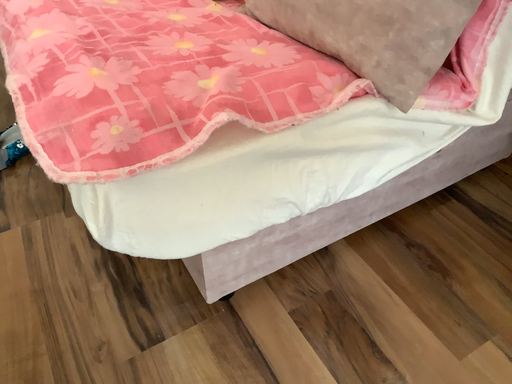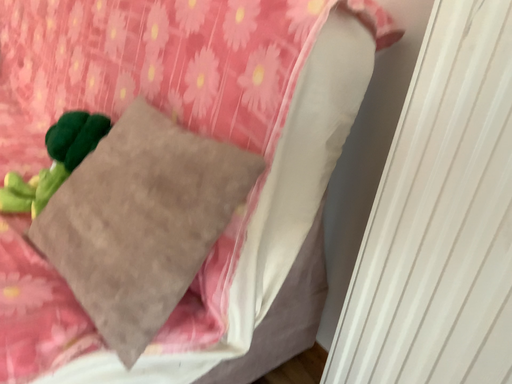
Question: How did the camera likely rotate when shooting the video?

Choices:
 (A) rotated left
 (B) rotated right

Answer: (B)